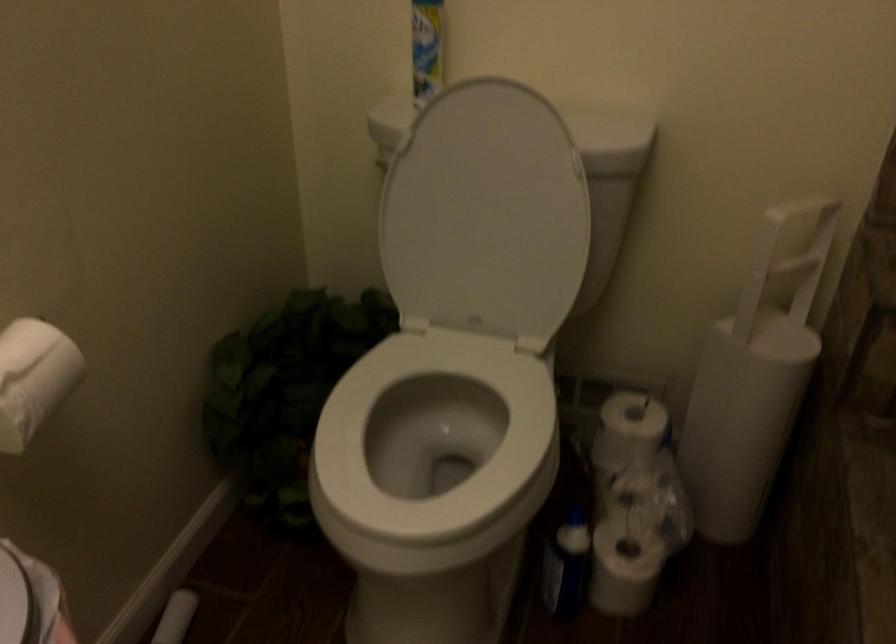
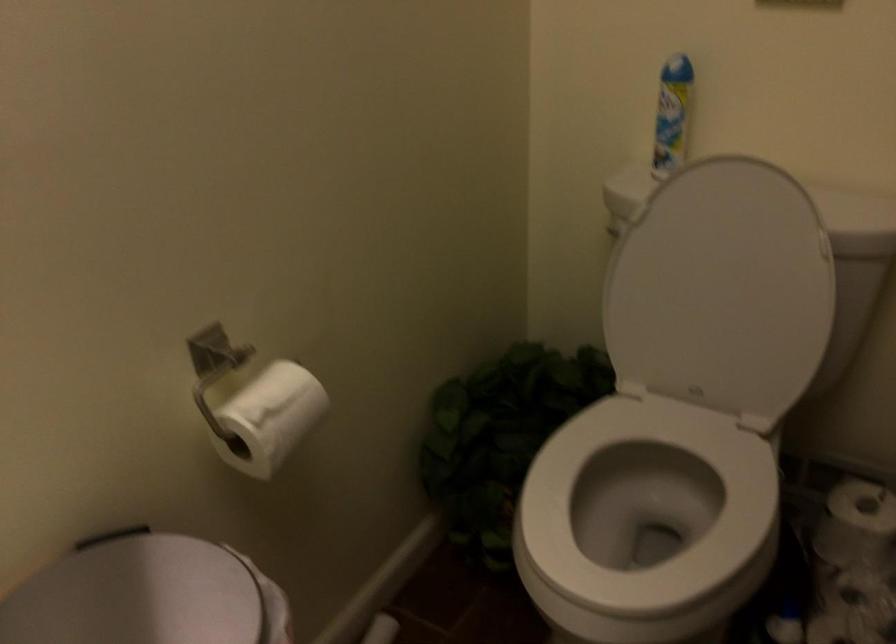
Locate, in the second image, the point that corresponds to the point at 493,218 in the first image.

(721, 289)